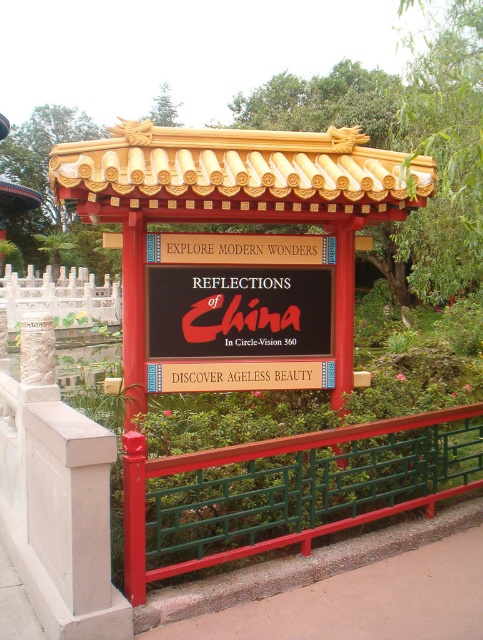
Who is taller, green metal fence at center or black matte sign at center?

green metal fence at center

Is point (242, 461) farther from viewer compared to point (264, 282)?

No, (242, 461) is closer to viewer.

Where is `green metal fence at center`? green metal fence at center is located at coordinates (288, 486).

Is point (268, 310) farther from viewer compared to point (115, 289)?

No, it is in front of (115, 289).

Is black matte sign at center behind white marble fence at center?

No, black matte sign at center is in front of white marble fence at center.

Locate an element on the screen. The image size is (483, 640). black matte sign at center is located at coordinates (238, 310).

Is point (459, 449) behind point (70, 317)?

That is False.

Is point (434, 412) positioned before point (68, 312)?

Yes, point (434, 412) is closer to viewer.

This screenshot has width=483, height=640. Identify the location of green metal fence at center. (288, 486).